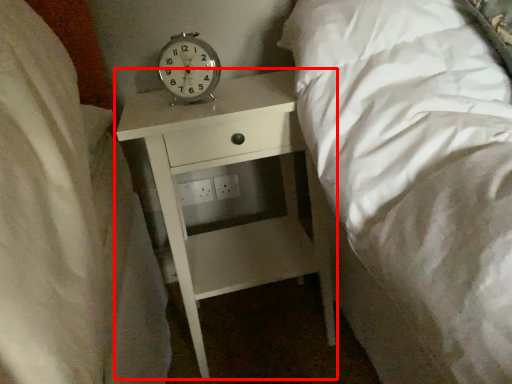
Question: Considering the relative positions of nightstand (annotated by the red box) and alarm clock in the image provided, where is nightstand (annotated by the red box) located with respect to the staircase?

Choices:
 (A) left
 (B) right

Answer: (B)